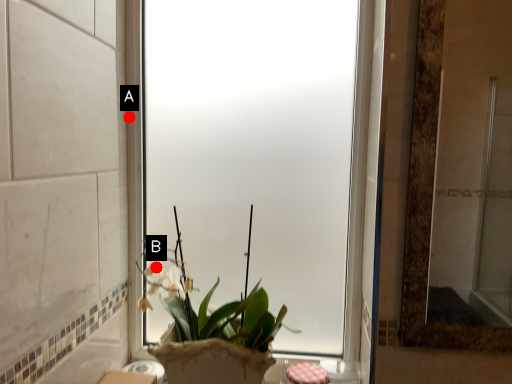
Question: Two points are circled on the image, labeled by A and B beside each circle. Which of the following is the farthest from the observer?

Choices:
 (A) A is further
 (B) B is further

Answer: (A)